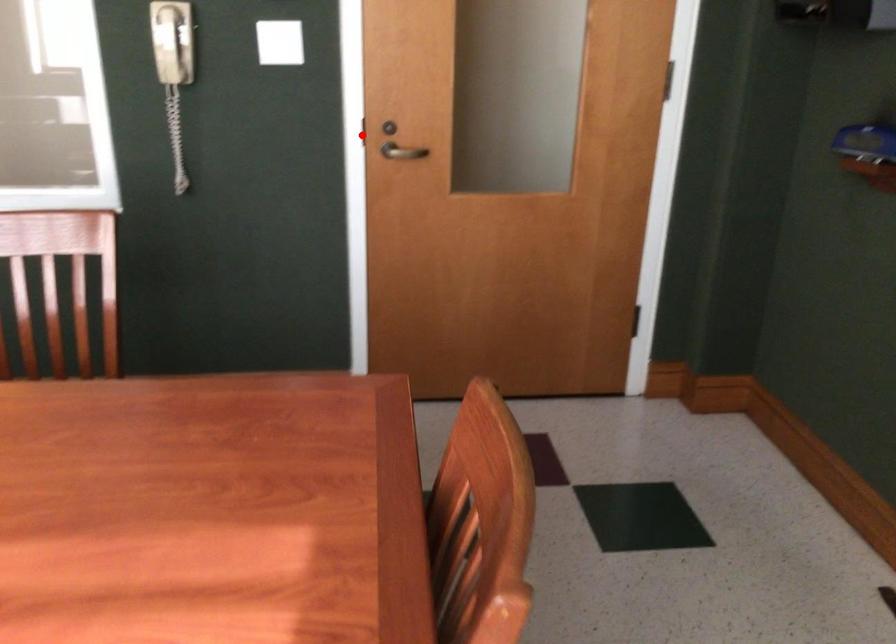
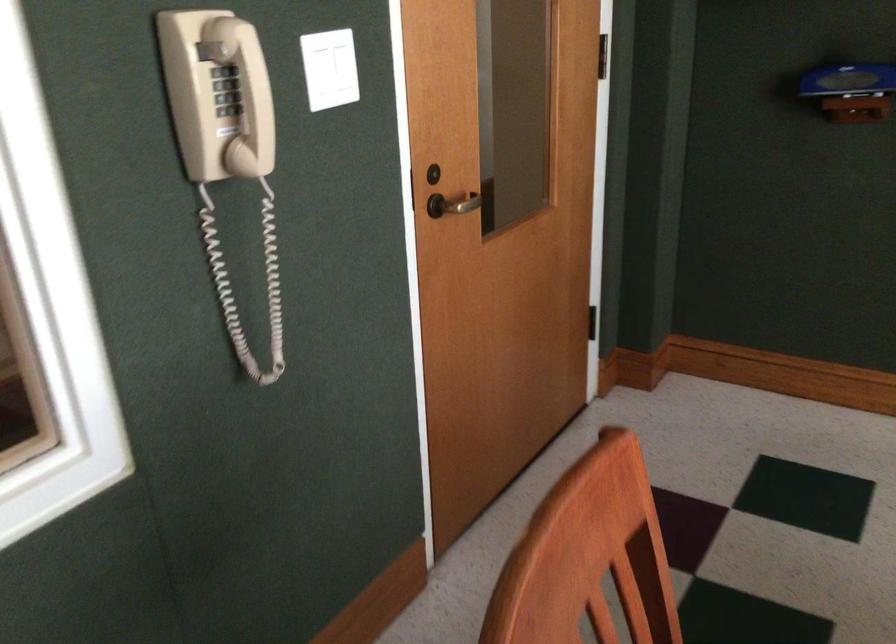
Question: A red point is marked in image1. In image2, is the corresponding 3D point closer to the camera or farther? Reply with the corresponding letter.

Choices:
 (A) The corresponding 3D point is closer.
 (B) The corresponding 3D point is farther.

Answer: (A)